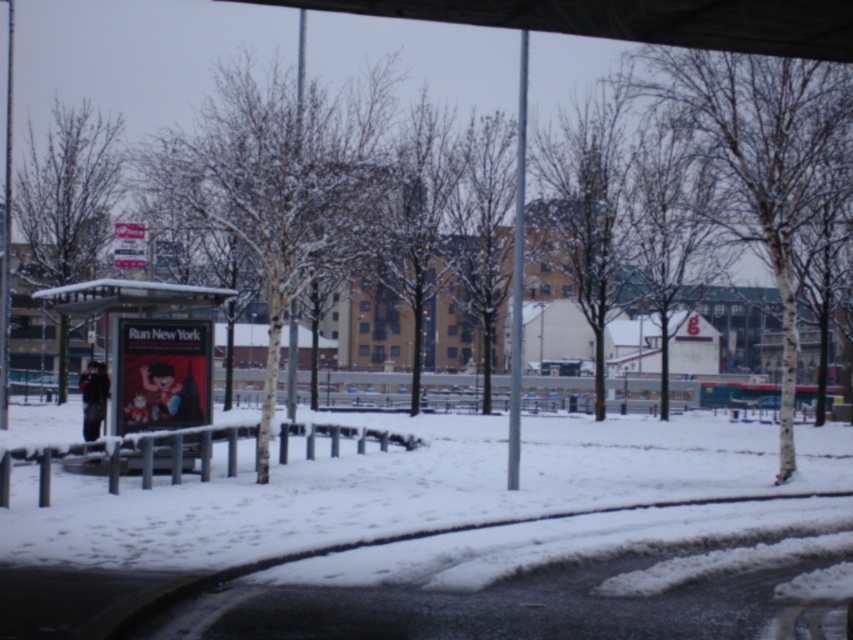
Question: Can you confirm if white powdery snow at lower center is wider than black tarp at upper center?

Choices:
 (A) no
 (B) yes

Answer: (B)

Question: Which is farther from the white plastic bus stop at left?

Choices:
 (A) black tarp at upper center
 (B) white powdery snow at lower center

Answer: (A)

Question: Which object appears farthest from the camera in this image?

Choices:
 (A) black tarp at upper center
 (B) white powdery snow at lower center
 (C) white plastic bus stop at left

Answer: (C)

Question: Is black tarp at upper center smaller than white plastic bus stop at left?

Choices:
 (A) no
 (B) yes

Answer: (B)

Question: Estimate the real-world distances between objects in this image. Which object is closer to the white plastic bus stop at left?

Choices:
 (A) white powdery snow at lower center
 (B) black tarp at upper center

Answer: (A)

Question: Can you confirm if black tarp at upper center is positioned to the right of white plastic bus stop at left?

Choices:
 (A) yes
 (B) no

Answer: (A)